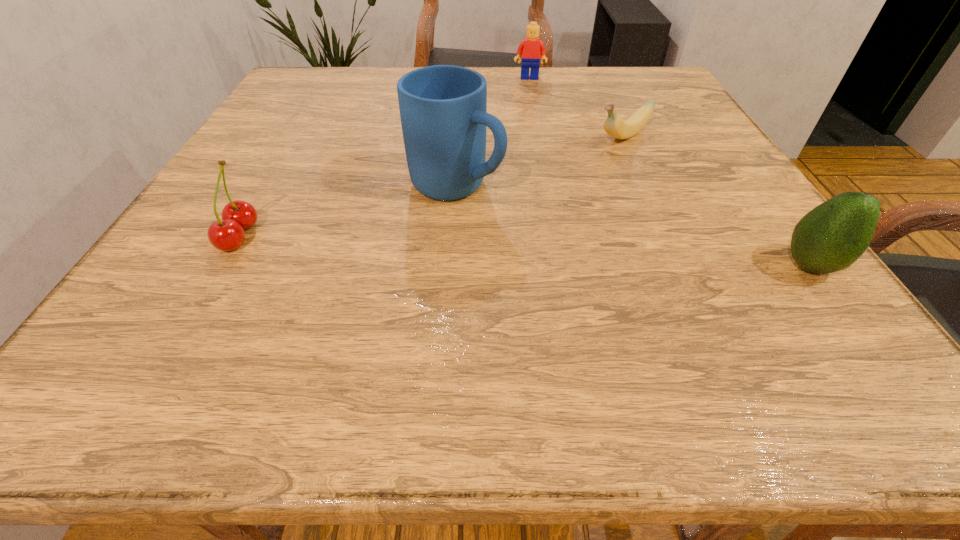
Locate an element on the screen. object located in the near edge section of the desktop is located at coordinates (832, 236).

Locate an element on the screen. This screenshot has height=540, width=960. object at the left edge is located at coordinates (226, 235).

Locate an element on the screen. avocado at the right edge is located at coordinates (x=832, y=236).

This screenshot has width=960, height=540. Find the location of `banana that is at the right edge`. banana that is at the right edge is located at coordinates (613, 125).

This screenshot has height=540, width=960. What are the coordinates of `object that is at the near right corner` in the screenshot? It's located at (832, 236).

In the image, there is a desktop. Where is `vacant space at the far edge`? vacant space at the far edge is located at coordinates click(x=468, y=66).

Locate an element on the screen. Image resolution: width=960 pixels, height=540 pixels. free location at the near edge is located at coordinates (385, 309).

The width and height of the screenshot is (960, 540). In the image, there is a desktop. What are the coordinates of `blank space at the left edge` in the screenshot? It's located at (252, 173).

Locate an element on the screen. The width and height of the screenshot is (960, 540). free space at the right edge is located at coordinates (745, 233).

In the image, there is a desktop. Identify the location of vacant area at the far left corner. The image size is (960, 540). 276,100.